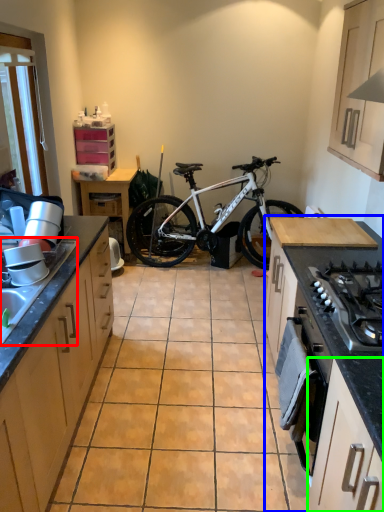
Question: Which object is positioned farthest from sink (highlighted by a red box)? Select from countertop (highlighted by a blue box) and cabinetry (highlighted by a green box).

Choices:
 (A) countertop
 (B) cabinetry

Answer: (A)